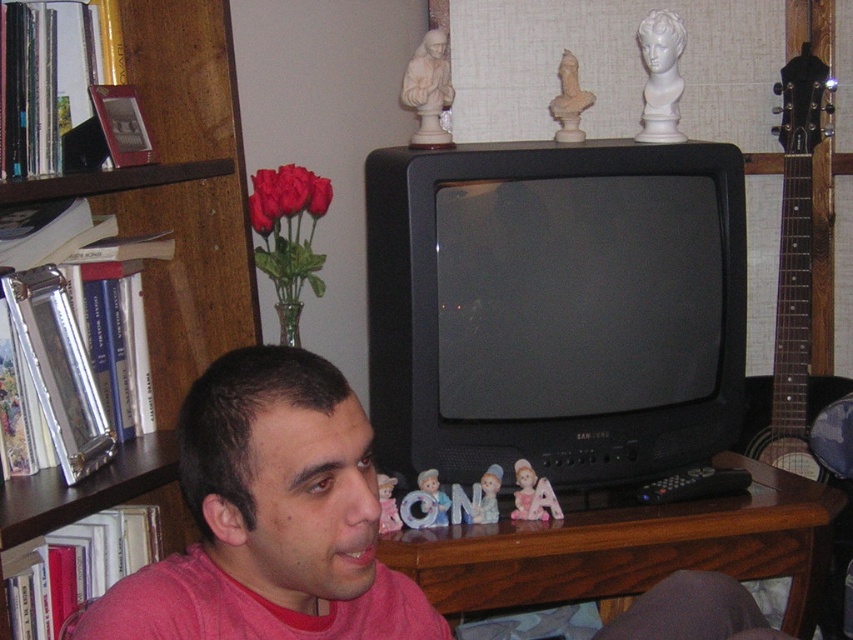
Is wooden bookshelf at left to the left of matte plastic doll at center from the viewer's perspective?

Yes, wooden bookshelf at left is to the left of matte plastic doll at center.

Is wooden bookshelf at left closer to the viewer compared to matte plastic doll at center?

Yes, wooden bookshelf at left is closer to the viewer.

From the picture: Who is more forward, (144,3) or (381,531)?

Point (381,531) is in front.

The image size is (853, 640). I want to click on wooden bookshelf at left, so click(x=172, y=236).

Does point (428, 83) come farther from viewer compared to point (434, 497)?

That is True.

Is white marble statue at upper center bigger than porcelain figurine at center?

Yes.

Is point (419, 120) more distant than point (444, 512)?

Yes, it is.

Where is `white marble statue at upper center`? The image size is (853, 640). white marble statue at upper center is located at coordinates (428, 90).

Does pink fabric doll at center have a greater height compared to porcelain doll at center?

Correct, pink fabric doll at center is much taller as porcelain doll at center.

Between pink fabric doll at center and porcelain doll at center, which one appears on the right side from the viewer's perspective?

pink fabric doll at center is more to the right.

Does point (521, 480) come in front of point (495, 464)?

Yes, it is.

The image size is (853, 640). I want to click on pink fabric doll at center, so click(x=526, y=492).